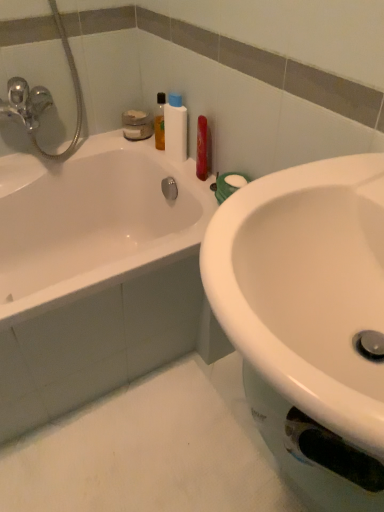
Question: In terms of size, does white glossy sink at center appear bigger or smaller than white glossy bathtub at upper left?

Choices:
 (A) big
 (B) small

Answer: (B)

Question: Choose the correct answer: Is white glossy sink at center inside white glossy bathtub at upper left or outside it?

Choices:
 (A) inside
 (B) outside

Answer: (B)

Question: Estimate the real-world distances between objects in this image. Which object is closer to the white glossy bathtub at upper left?

Choices:
 (A) white glossy sink at center
 (B) white plastic bottle at upper center

Answer: (B)

Question: Based on their relative distances, which object is nearer to the white glossy sink at center?

Choices:
 (A) white plastic bottle at upper center
 (B) white glossy bathtub at upper left

Answer: (B)